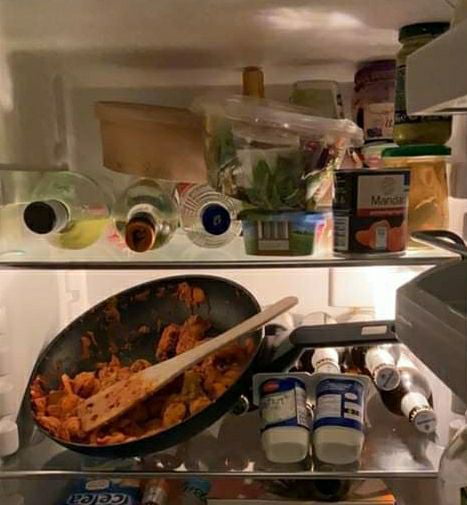
Find the location of `top shelf`. top shelf is located at coordinates (112, 240).